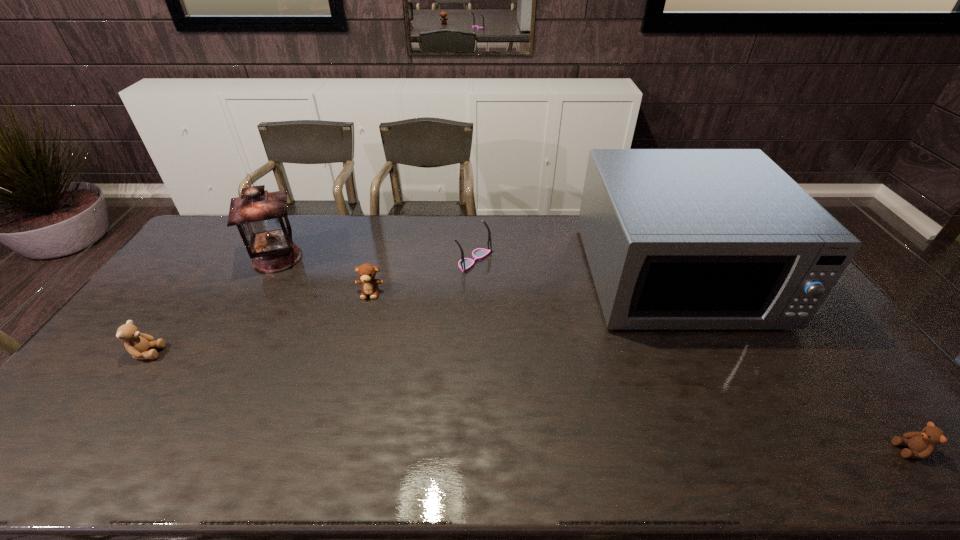
Locate an element on the screen. object that stands as the second closest to the nearest object is located at coordinates (464, 264).

Point out which teddy bear is positioned as the second nearest to the fifth object from right to left. Please provide its 2D coordinates. Your answer should be formatted as a tuple, i.e. [(x, y)], where the tuple contains the x and y coordinates of a point satisfying the conditions above.

[(138, 344)]

Point out which teddy bear is positioned as the nearest to the leftmost teddy bear. Please provide its 2D coordinates. Your answer should be formatted as a tuple, i.e. [(x, y)], where the tuple contains the x and y coordinates of a point satisfying the conditions above.

[(366, 272)]

The image size is (960, 540). What are the coordinates of `vacant region that satisfies the following two spatial constraints: 1. with the door open on the microwave oven; 2. on the front-facing side of the leftmost object` in the screenshot? It's located at (714, 353).

I want to click on free region that satisfies the following two spatial constraints: 1. on the face of the farthest teddy bear; 2. on the front-facing side of the second nearest object, so click(354, 353).

At what (x,y) coordinates should I click in order to perform the action: click on vacant area in the image that satisfies the following two spatial constraints: 1. on the face of the fourth object from right to left; 2. on the front-facing side of the fifth farthest object. Please return your answer as a coordinate pair (x, y). This screenshot has width=960, height=540. Looking at the image, I should click on (354, 353).